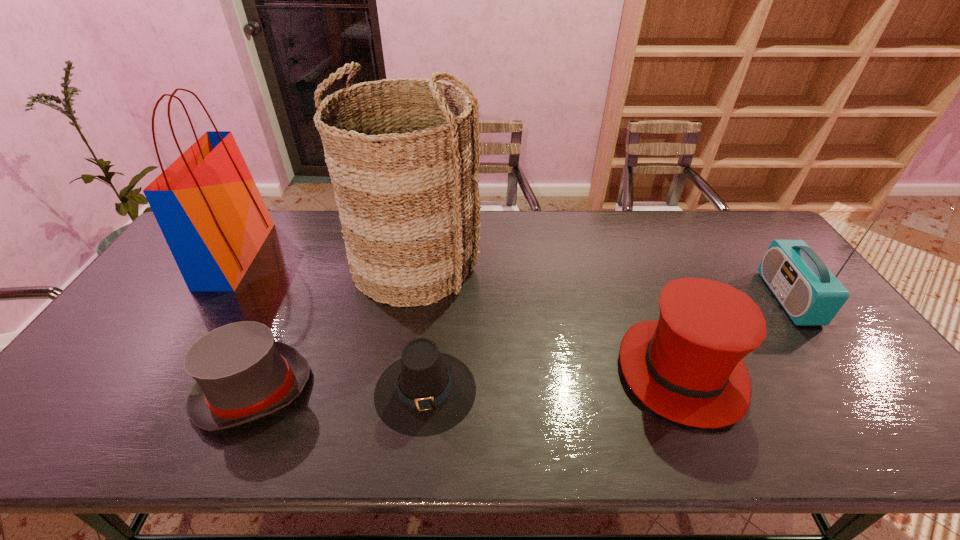
The width and height of the screenshot is (960, 540). Identify the location of vacant space in between the shopping bag and the second hat from right to left. (330, 322).

The image size is (960, 540). Find the location of `empty space that is in between the leftmost object and the fifth object from left to right`. empty space that is in between the leftmost object and the fifth object from left to right is located at coordinates tap(459, 313).

Find the location of a particular element. Image resolution: width=960 pixels, height=540 pixels. empty location between the shopping bag and the second hat from right to left is located at coordinates (330, 322).

This screenshot has height=540, width=960. In order to click on free space between the radio receiver and the second hat from left to right in this screenshot , I will do `click(607, 344)`.

Find the location of a particular element. the second closest object to the second hat from right to left is located at coordinates (242, 374).

Select which object is the second closest to the basket. Please provide its 2D coordinates. Your answer should be formatted as a tuple, i.e. [(x, y)], where the tuple contains the x and y coordinates of a point satisfying the conditions above.

[(426, 392)]

Where is `the third closest hat to the rightmost object`? The image size is (960, 540). the third closest hat to the rightmost object is located at coordinates (242, 374).

I want to click on hat that is the closest to the shopping bag, so click(x=242, y=374).

The height and width of the screenshot is (540, 960). In order to click on free spot that satisfies the following two spatial constraints: 1. on the back side of the second object from right to left; 2. on the handle side of the shopping bag in this screenshot , I will do `click(634, 255)`.

Where is `free spot that satisfies the following two spatial constraints: 1. on the handle side of the shopping bag; 2. on the right side of the tallest hat`? The image size is (960, 540). free spot that satisfies the following two spatial constraints: 1. on the handle side of the shopping bag; 2. on the right side of the tallest hat is located at coordinates (160, 371).